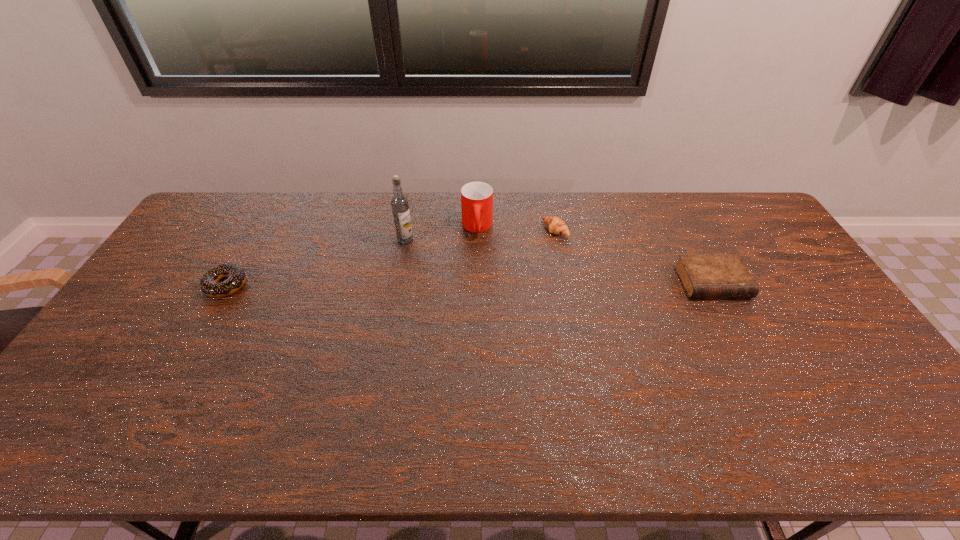
I want to click on vacant space at the far edge of the desktop, so click(685, 205).

You are a GUI agent. You are given a task and a screenshot of the screen. Output one action in this format:
    pyautogui.click(x=<x>, y=<y>)
    Task: Click on the free space at the near edge of the desktop
    This screenshot has width=960, height=540.
    Given the screenshot: What is the action you would take?
    pyautogui.click(x=293, y=384)

The image size is (960, 540). What are the coordinates of `free space at the left edge` in the screenshot? It's located at (146, 338).

What are the coordinates of `vacant position at the right edge of the desktop` in the screenshot? It's located at (828, 325).

The image size is (960, 540). I want to click on free space between the leftmost object and the fourth object from left to right, so click(x=391, y=258).

Locate an element on the screen. free area in between the pastry and the vodka is located at coordinates (480, 235).

The height and width of the screenshot is (540, 960). Find the location of `free spot between the pastry and the doughnut`. free spot between the pastry and the doughnut is located at coordinates tap(391, 258).

This screenshot has width=960, height=540. In order to click on vacant space that is in between the doughnut and the diary in this screenshot , I will do `click(469, 284)`.

Image resolution: width=960 pixels, height=540 pixels. Find the location of `vacant space that is in between the pastry and the cup`. vacant space that is in between the pastry and the cup is located at coordinates (516, 229).

Identify the location of free space between the pastry and the third object from left to right. This screenshot has height=540, width=960. (516, 229).